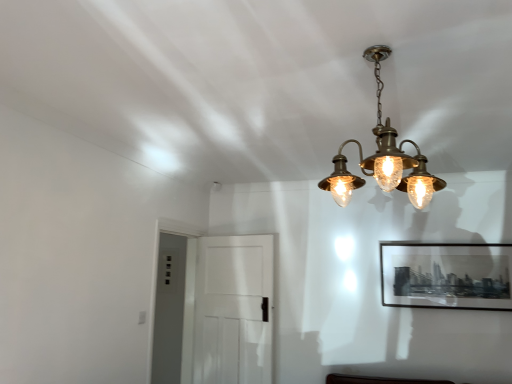
Identify the location of white matte door at center. Image resolution: width=512 pixels, height=384 pixels. (234, 310).

This screenshot has width=512, height=384. Find the location of `black matte picture frame at upper right`. black matte picture frame at upper right is located at coordinates (446, 275).

Would you say white matte door at center is outside black matte picture frame at upper right?

Yes, white matte door at center is outside of black matte picture frame at upper right.

Is white matte door at center aimed at black matte picture frame at upper right?

No.

Find the location of a particular element. Image resolution: width=512 pixels, height=384 pixels. picture frame behind the white matte door at center is located at coordinates (446, 275).

From the image's perspective, is white matte door at center over black matte picture frame at upper right?

No.

Looking at this image, is brass/bronze chandelier at upper center aimed at black matte picture frame at upper right?

No, brass/bronze chandelier at upper center is not turned towards black matte picture frame at upper right.

Does brass/bronze chandelier at upper center touch black matte picture frame at upper right?

No, brass/bronze chandelier at upper center is not in contact with black matte picture frame at upper right.

Is brass/bronze chandelier at upper center positioned before black matte picture frame at upper right?

Yes, brass/bronze chandelier at upper center is closer to the camera.

Is point (379, 59) closer or farther from the camera than point (462, 269)?

Point (379, 59).

Is black matte picture frame at upper right not inside brass/bronze chandelier at upper center?

That's correct, black matte picture frame at upper right is outside of brass/bronze chandelier at upper center.

Looking at this image, which object is more forward, black matte picture frame at upper right or brass/bronze chandelier at upper center?

Positioned in front is brass/bronze chandelier at upper center.

Is point (458, 267) more distant than point (335, 156)?

That is True.

Is black matte picture frame at upper right further to the viewer compared to white matte door at center?

Yes, it is behind white matte door at center.

Is black matte picture frame at upper right completely or partially outside of white matte door at center?

Yes, black matte picture frame at upper right is not within white matte door at center.

Considering the relative positions of black matte picture frame at upper right and white matte door at center in the image provided, is black matte picture frame at upper right to the left or to the right of white matte door at center?

Clearly, black matte picture frame at upper right is on the right of white matte door at center in the image.

Which is behind, point (486, 251) or point (241, 302)?

Positioned behind is point (241, 302).

In the image, is brass/bronze chandelier at upper center positioned in front of or behind white matte door at center?

In the image, brass/bronze chandelier at upper center appears in front of white matte door at center.

Can you confirm if brass/bronze chandelier at upper center is shorter than white matte door at center?

Yes.

Between white matte door at center and brass/bronze chandelier at upper center, which one appears on the right side from the viewer's perspective?

Positioned to the right is brass/bronze chandelier at upper center.

Between point (222, 353) and point (378, 51), which one is positioned in front?

The point (378, 51) is closer.

Is white matte door at center spatially inside brass/bronze chandelier at upper center, or outside of it?

The correct answer is: outside.

From a real-world perspective, is white matte door at center above or below brass/bronze chandelier at upper center?

Clearly, from a real-world perspective, white matte door at center is below brass/bronze chandelier at upper center.

Where is `picture frame behind the white matte door at center`? The image size is (512, 384). picture frame behind the white matte door at center is located at coordinates (446, 275).

The width and height of the screenshot is (512, 384). Find the location of `picture frame on the right side of brass/bronze chandelier at upper center`. picture frame on the right side of brass/bronze chandelier at upper center is located at coordinates (446, 275).

In the scene shown: Considering their positions, is white matte door at center positioned further to brass/bronze chandelier at upper center than black matte picture frame at upper right?

white matte door at center is further to brass/bronze chandelier at upper center.

From the image, which object appears to be nearer to black matte picture frame at upper right, white matte door at center or brass/bronze chandelier at upper center?

Among the two, white matte door at center is located nearer to black matte picture frame at upper right.

Estimate the real-world distances between objects in this image. Which object is further from black matte picture frame at upper right, brass/bronze chandelier at upper center or white matte door at center?

brass/bronze chandelier at upper center lies further to black matte picture frame at upper right than the other object.

Looking at the image, which one is located closer to brass/bronze chandelier at upper center, black matte picture frame at upper right or white matte door at center?

black matte picture frame at upper right is closer to brass/bronze chandelier at upper center.

Which object lies nearer to the anchor point white matte door at center, black matte picture frame at upper right or brass/bronze chandelier at upper center?

black matte picture frame at upper right lies closer to white matte door at center than the other object.

Which object lies nearer to the anchor point white matte door at center, brass/bronze chandelier at upper center or black matte picture frame at upper right?

Based on the image, black matte picture frame at upper right appears to be nearer to white matte door at center.

Locate an element on the screen. The image size is (512, 384). glass door located between brass/bronze chandelier at upper center and black matte picture frame at upper right in the depth direction is located at coordinates (234, 310).